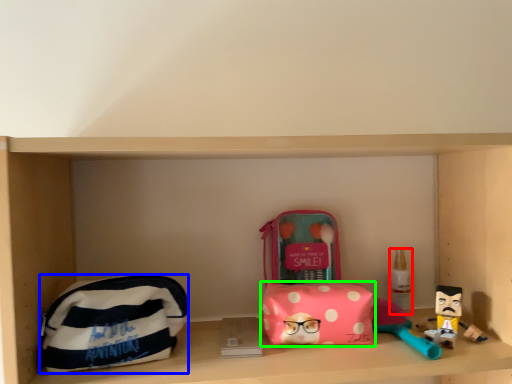
Question: Considering the real-world distances, which object is farthest from toiletry (highlighted by a red box)? pouch (highlighted by a blue box) or pouch (highlighted by a green box)?

Choices:
 (A) pouch
 (B) pouch

Answer: (A)